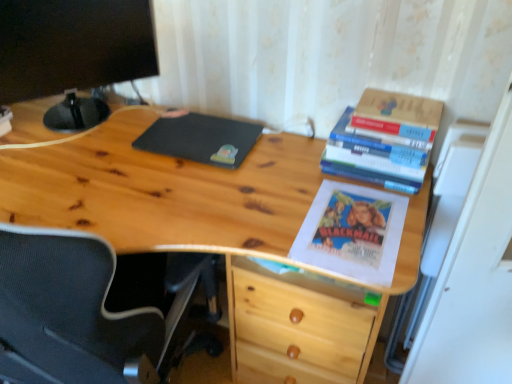
You are a GUI agent. You are given a task and a screenshot of the screen. Output one action in this format:
    pyautogui.click(x=<x>, y=<y>)
    Task: Click on the free area in between black matte mousepad at center and hardcover books at upper right, the 1th book when ordered from bottom to top
    
    Given the screenshot: What is the action you would take?
    pyautogui.click(x=295, y=163)